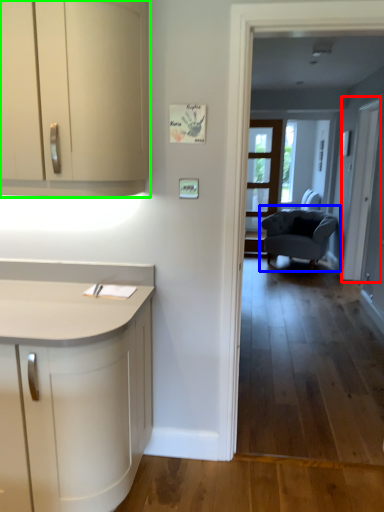
Question: Which object is positioned farthest from screen door (highlighted by a red box)? Select from chair (highlighted by a blue box) and cabinetry (highlighted by a green box).

Choices:
 (A) chair
 (B) cabinetry

Answer: (B)